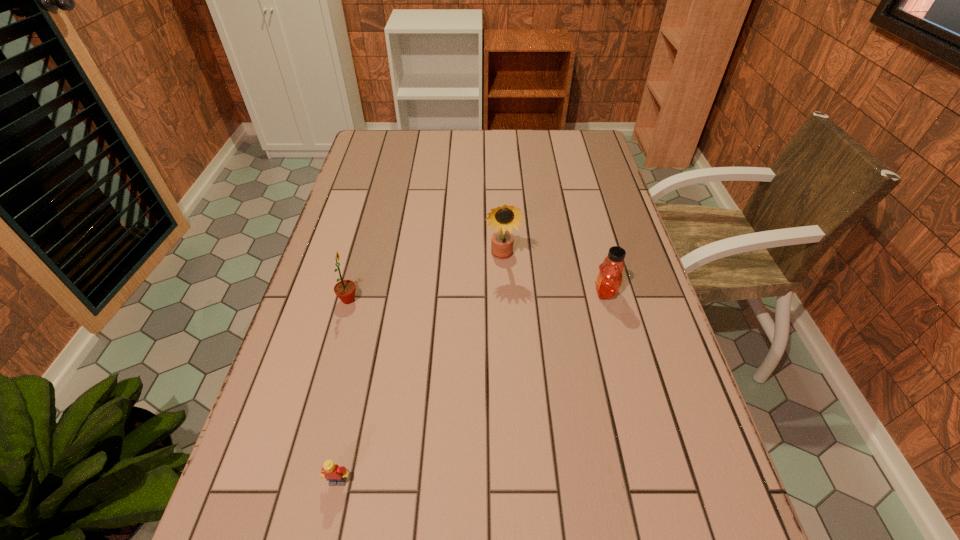
This screenshot has width=960, height=540. What are the coordinates of `vacant space positioned on the front label of the rightmost object` in the screenshot? It's located at (443, 292).

Locate an element on the screen. This screenshot has width=960, height=540. free location located 0.170m on the front label of the rightmost object is located at coordinates (527, 292).

Find the location of a particular element. The width and height of the screenshot is (960, 540). free space located 0.170m on the front label of the rightmost object is located at coordinates (527, 292).

The image size is (960, 540). Find the location of `vacant space positioned on the front-facing side of the third object from right to left`. vacant space positioned on the front-facing side of the third object from right to left is located at coordinates (329, 522).

At what (x,y) coordinates should I click in order to perform the action: click on sunflower that is at the left edge. Please return your answer as a coordinate pair (x, y). This screenshot has height=540, width=960. Looking at the image, I should click on (345, 289).

In order to click on Lego situated at the left edge in this screenshot , I will do `click(336, 475)`.

At what (x,y) coordinates should I click in order to perform the action: click on object situated at the right edge. Please return your answer as a coordinate pair (x, y). Looking at the image, I should click on (609, 279).

In the image, there is a desktop. Where is `vacant space at the far edge`? vacant space at the far edge is located at coordinates (553, 146).

The image size is (960, 540). In order to click on vacant area at the left edge of the desktop in this screenshot , I will do click(x=350, y=201).

Find the location of `free location at the right edge`. free location at the right edge is located at coordinates (626, 360).